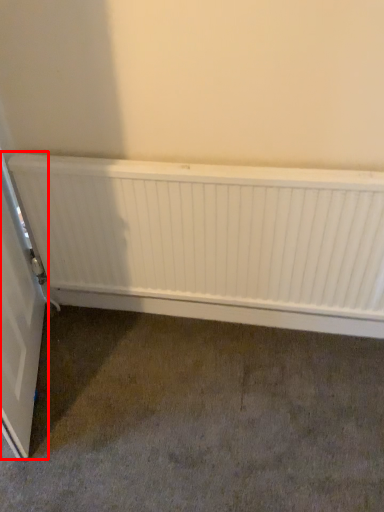
Question: From the image's perspective, what is the correct spatial relationship of door (annotated by the red box) in relation to radiator?

Choices:
 (A) below
 (B) above

Answer: (A)